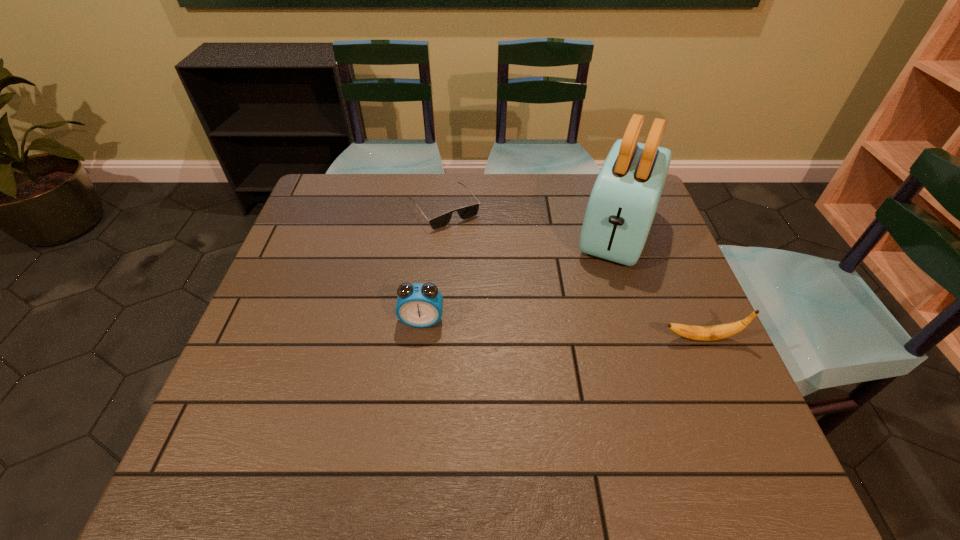
Image resolution: width=960 pixels, height=540 pixels. I want to click on vacant region that satisfies the following two spatial constraints: 1. on the front side of the sunglasses; 2. on the peel of the nearest object from the top, so click(432, 338).

Find the location of `vacant region that satisfies the following two spatial constraints: 1. on the front side of the tallest object; 2. on the right side of the shortest object`. vacant region that satisfies the following two spatial constraints: 1. on the front side of the tallest object; 2. on the right side of the shortest object is located at coordinates (442, 232).

You are a GUI agent. You are given a task and a screenshot of the screen. Output one action in this format:
    pyautogui.click(x=<x>, y=<y>)
    Task: Click on the free space that satisfies the following two spatial constraints: 1. on the face of the third tallest object; 2. on the peel of the alarm clock from the top
    
    Given the screenshot: What is the action you would take?
    pyautogui.click(x=420, y=338)

The image size is (960, 540). I want to click on free region that satisfies the following two spatial constraints: 1. on the front side of the nearest object; 2. on the peel of the tallest object from the top, so click(x=652, y=338).

Where is `vacant space that satisfies the following two spatial constraints: 1. on the face of the alarm clock; 2. on the peel of the second shortest object from the top`? The width and height of the screenshot is (960, 540). vacant space that satisfies the following two spatial constraints: 1. on the face of the alarm clock; 2. on the peel of the second shortest object from the top is located at coordinates (420, 338).

Identify the location of free region that satisfies the following two spatial constraints: 1. on the face of the second nearest object; 2. on the peel of the nearest object from the top. This screenshot has height=540, width=960. (420, 338).

Identify the location of vacant area that satisfies the following two spatial constraints: 1. on the face of the alarm clock; 2. on the peel of the third tallest object from the top. (420, 338).